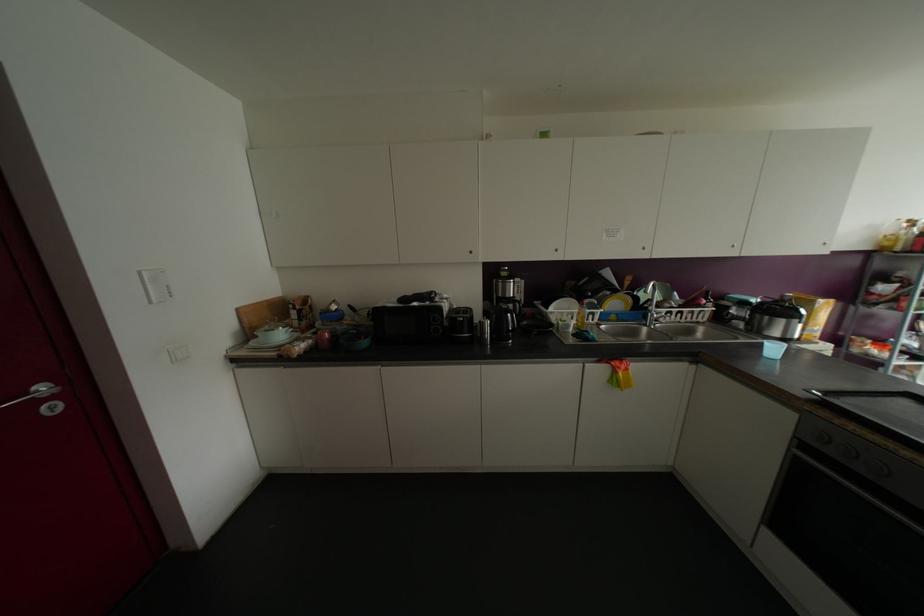
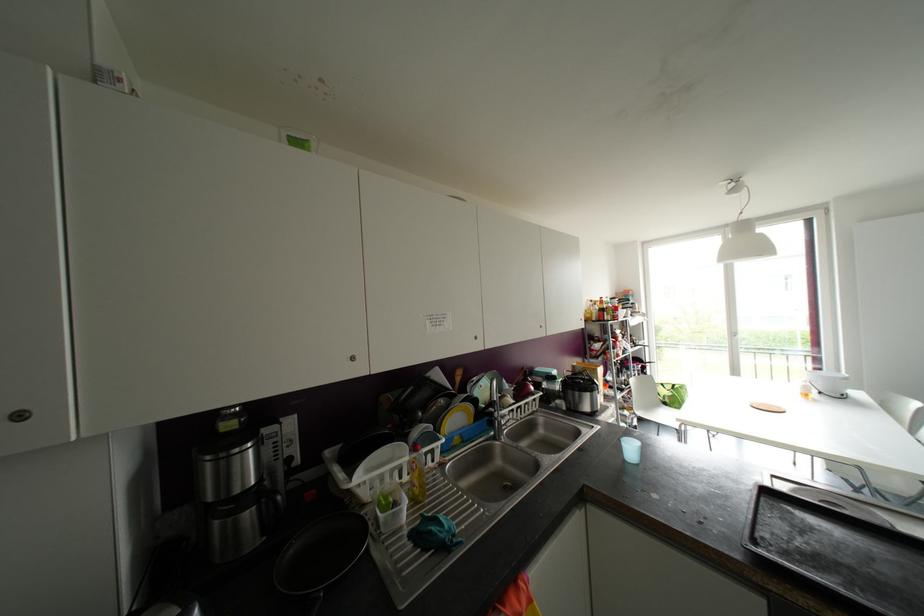
Locate, in the second image, the point that corresponds to point (651, 314) in the first image.

(499, 422)